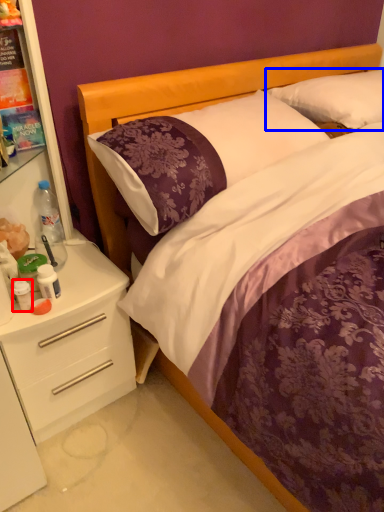
Question: Which object is further to the camera taking this photo, bottle (highlighted by a red box) or pillow (highlighted by a blue box)?

Choices:
 (A) bottle
 (B) pillow

Answer: (B)